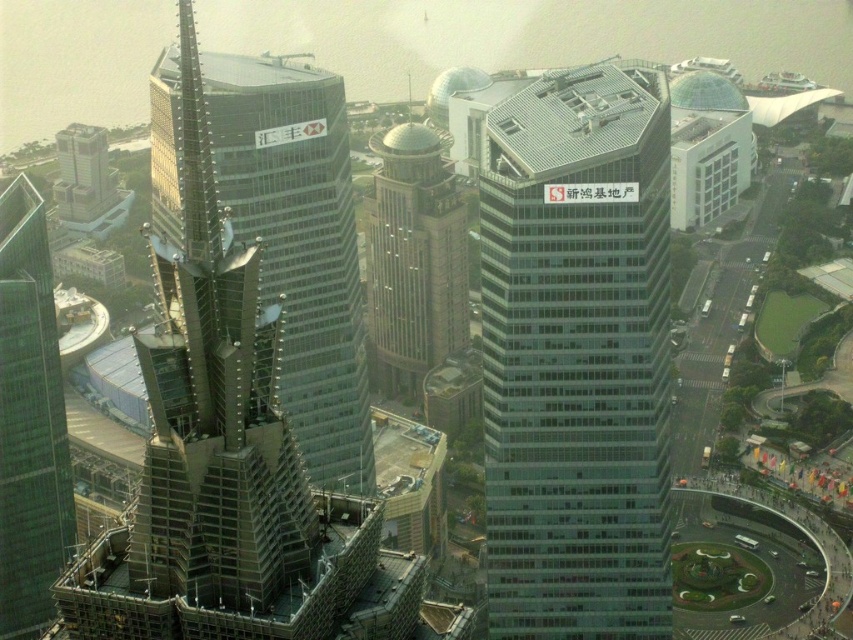
Question: Which point is farther to the camera?

Choices:
 (A) (36, 285)
 (B) (312, 109)
 (C) (409, 196)

Answer: (C)

Question: Does transparent glass building at center lie behind gold textured dome at center?

Choices:
 (A) no
 (B) yes

Answer: (A)

Question: Estimate the real-world distances between objects in this image. Which object is closer to the transparent glass skyscraper at center?

Choices:
 (A) gold textured dome at center
 (B) green glass skyscraper at left

Answer: (A)

Question: Which object appears farthest from the camera in this image?

Choices:
 (A) gold textured dome at center
 (B) glassy steel skyscraper at left
 (C) green glass skyscraper at left
 (D) transparent glass building at center

Answer: (A)

Question: Where is green glass skyscraper at left located in relation to gold textured dome at center in the image?

Choices:
 (A) below
 (B) above

Answer: (A)

Question: Is transparent glass building at center thinner than gold textured dome at center?

Choices:
 (A) no
 (B) yes

Answer: (A)